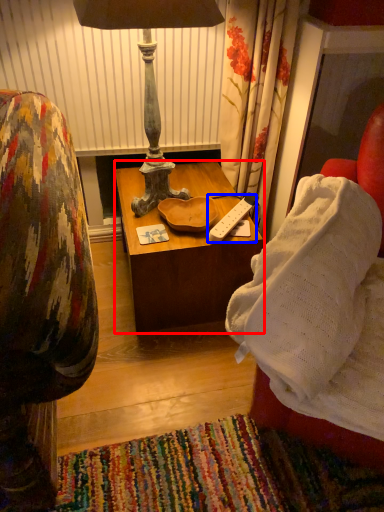
Question: Which object is closer to the camera taking this photo, table (highlighted by a red box) or remote (highlighted by a blue box)?

Choices:
 (A) table
 (B) remote

Answer: (A)